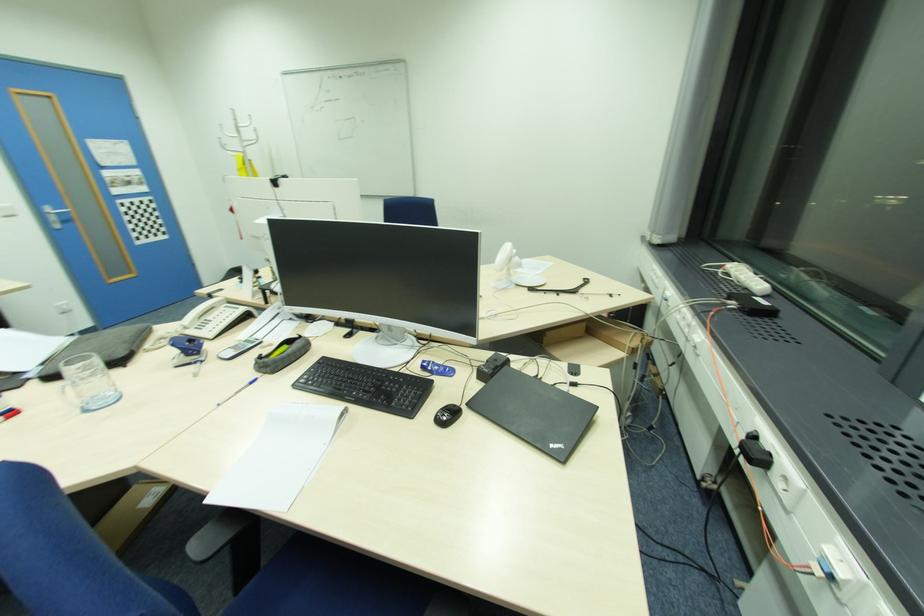
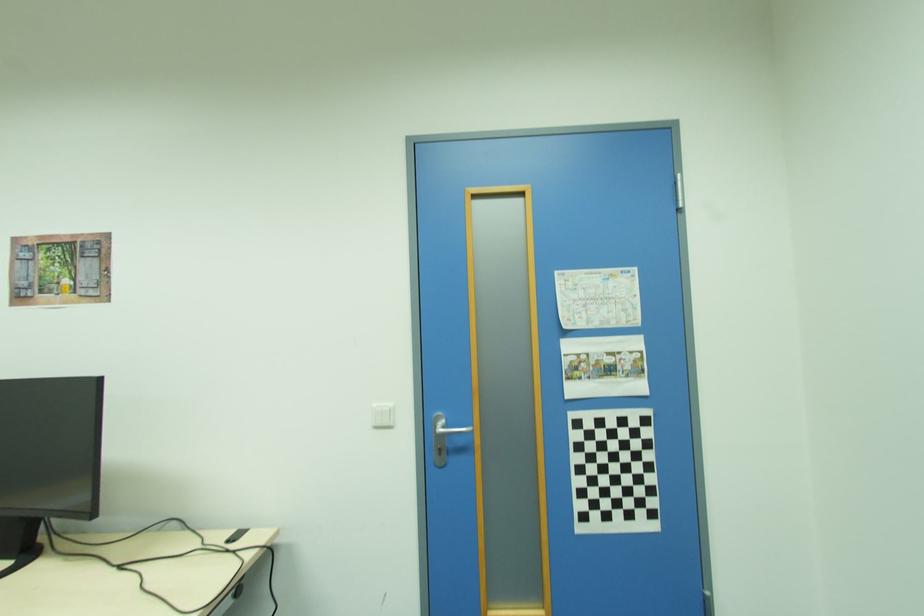
Locate, in the second image, the point that corresponds to (x=54, y=213) in the first image.

(439, 429)